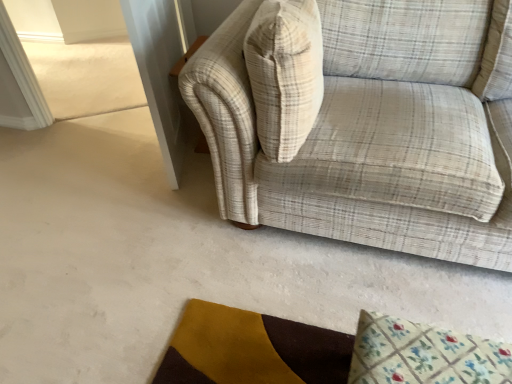
What do you see at coordinates (285, 74) in the screenshot? I see `beige plaid throw pillow at upper right` at bounding box center [285, 74].

Identify the location of plaid fabric couch at upper right. (364, 122).

Which is in front, point (447, 342) or point (287, 74)?

The point (447, 342) is closer.

From the image's perspective, is floral fabric mat at lower right located above or below beige plaid throw pillow at upper right?

From the image's perspective, floral fabric mat at lower right appears below beige plaid throw pillow at upper right.

Can you confirm if floral fabric mat at lower right is taller than beige plaid throw pillow at upper right?

No, floral fabric mat at lower right is not taller than beige plaid throw pillow at upper right.

Based on their sizes in the image, would you say floral fabric mat at lower right is bigger or smaller than beige plaid throw pillow at upper right?

Clearly, floral fabric mat at lower right is smaller in size than beige plaid throw pillow at upper right.

Does plaid fabric couch at upper right turn towards beige plaid throw pillow at upper right?

Yes, plaid fabric couch at upper right is facing beige plaid throw pillow at upper right.

Looking at their sizes, would you say plaid fabric couch at upper right is wider or thinner than beige plaid throw pillow at upper right?

Clearly, plaid fabric couch at upper right has more width compared to beige plaid throw pillow at upper right.

Which is closer to the camera, (x=412, y=63) or (x=280, y=128)?

The point (x=280, y=128) is in front.

Is beige plaid throw pillow at upper right next to floral fabric mat at lower right and touching it?

beige plaid throw pillow at upper right is not next to floral fabric mat at lower right, and they're not touching.

Does point (282, 38) lie behind point (504, 345)?

Yes, point (282, 38) is farther from viewer.

Based on the photo, does beige plaid throw pillow at upper right have a larger size compared to floral fabric mat at lower right?

Indeed, beige plaid throw pillow at upper right has a larger size compared to floral fabric mat at lower right.

Considering the relative sizes of beige plaid throw pillow at upper right and floral fabric mat at lower right in the image provided, is beige plaid throw pillow at upper right shorter than floral fabric mat at lower right?

No, beige plaid throw pillow at upper right is not shorter than floral fabric mat at lower right.

Is plaid fabric couch at upper right oriented away from floral fabric mat at lower right?

No, floral fabric mat at lower right is not at the back of plaid fabric couch at upper right.

Is point (412, 131) farther from camera compared to point (509, 365)?

Yes, point (412, 131) is farther from viewer.

Where is `mat behind the plaid fabric couch at upper right`? The image size is (512, 384). mat behind the plaid fabric couch at upper right is located at coordinates (424, 354).

From a real-world perspective, is beige plaid throw pillow at upper right beneath plaid fabric couch at upper right?

Incorrect, from a real-world perspective, beige plaid throw pillow at upper right is higher than plaid fabric couch at upper right.

Who is bigger, beige plaid throw pillow at upper right or plaid fabric couch at upper right?

With larger size is plaid fabric couch at upper right.

Could you tell me if beige plaid throw pillow at upper right is turned towards plaid fabric couch at upper right?

Yes, beige plaid throw pillow at upper right is turned towards plaid fabric couch at upper right.

In the image, there is a plaid fabric couch at upper right. Where is `throw pillow above it (from the image's perspective)`? throw pillow above it (from the image's perspective) is located at coordinates [285, 74].

Based on the photo, from the image's perspective, between floral fabric mat at lower right and plaid fabric couch at upper right, who is located below?

floral fabric mat at lower right appears lower in the image.

From the picture: Is floral fabric mat at lower right wider or thinner than plaid fabric couch at upper right?

Considering their sizes, floral fabric mat at lower right looks slimmer than plaid fabric couch at upper right.

From a real-world perspective, is floral fabric mat at lower right located higher than plaid fabric couch at upper right?

Incorrect, from a real-world perspective, floral fabric mat at lower right is lower than plaid fabric couch at upper right.

Does floral fabric mat at lower right contain plaid fabric couch at upper right?

No, plaid fabric couch at upper right is located outside of floral fabric mat at lower right.

This screenshot has width=512, height=384. I want to click on throw pillow behind the floral fabric mat at lower right, so click(285, 74).

I want to click on throw pillow above the plaid fabric couch at upper right (from the image's perspective), so click(285, 74).

Based on their spatial positions, is floral fabric mat at lower right or plaid fabric couch at upper right further from beige plaid throw pillow at upper right?

The object further to beige plaid throw pillow at upper right is floral fabric mat at lower right.

Based on their spatial positions, is beige plaid throw pillow at upper right or plaid fabric couch at upper right further from floral fabric mat at lower right?

beige plaid throw pillow at upper right.

Looking at the image, which one is located further to floral fabric mat at lower right, plaid fabric couch at upper right or beige plaid throw pillow at upper right?

The object further to floral fabric mat at lower right is beige plaid throw pillow at upper right.

From the image, which object appears to be farther from plaid fabric couch at upper right, floral fabric mat at lower right or beige plaid throw pillow at upper right?

→ floral fabric mat at lower right.

In the scene shown: Which object lies further to the anchor point beige plaid throw pillow at upper right, plaid fabric couch at upper right or floral fabric mat at lower right?

floral fabric mat at lower right is further to beige plaid throw pillow at upper right.

Based on their spatial positions, is beige plaid throw pillow at upper right or floral fabric mat at lower right closer to plaid fabric couch at upper right?

Based on the image, beige plaid throw pillow at upper right appears to be nearer to plaid fabric couch at upper right.

You are a GUI agent. You are given a task and a screenshot of the screen. Output one action in this format:
    pyautogui.click(x=<x>, y=<y>)
    Task: Click on the studio couch between beige plaid throw pillow at upper right and floral fabric mat at lower right vertically
    
    Given the screenshot: What is the action you would take?
    click(364, 122)